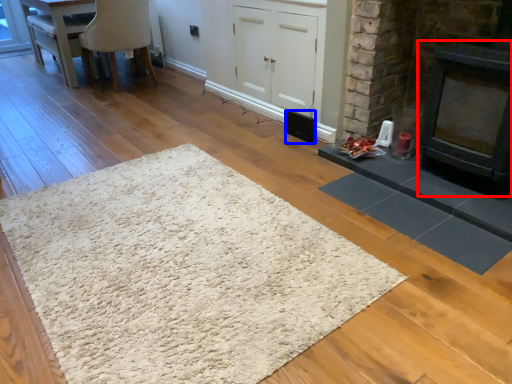
Question: Among these objects, which one is farthest to the camera, fireplace (highlighted by a red box) or speaker (highlighted by a blue box)?

Choices:
 (A) fireplace
 (B) speaker

Answer: (B)